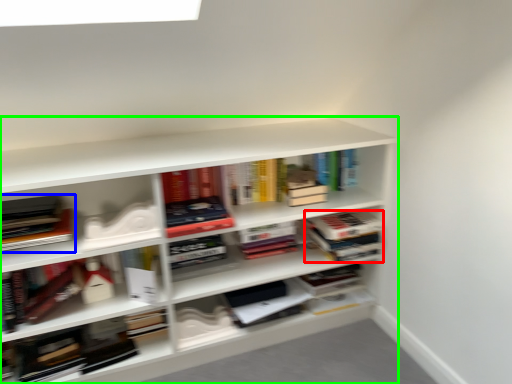
Question: Estimate the real-world distances between objects in this image. Which object is farther from book (highlighted by a red box), book (highlighted by a blue box) or shelf (highlighted by a green box)?

Choices:
 (A) book
 (B) shelf

Answer: (A)